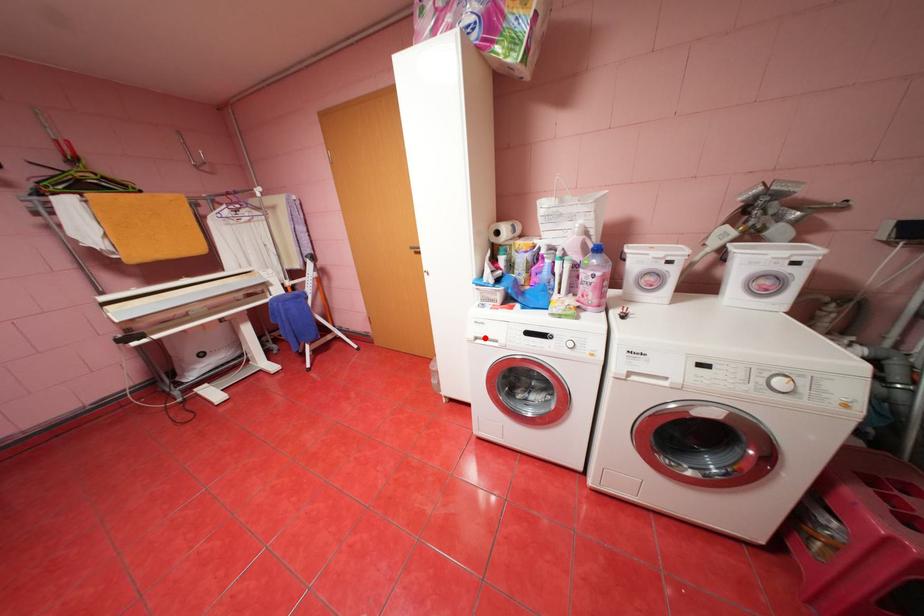
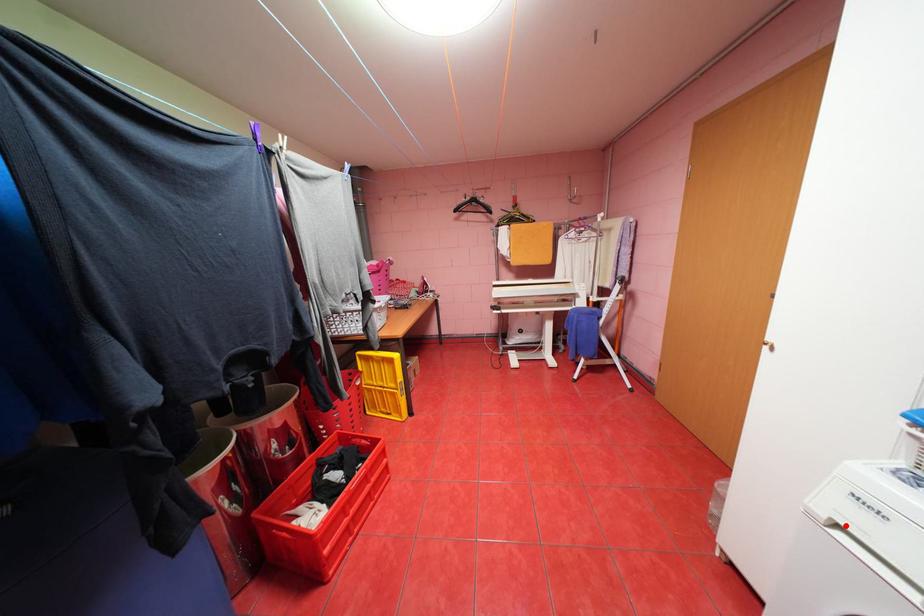
I am providing you with two images of the same scene from different viewpoints. A red point is marked on the first image and another point is marked on the second image. Do the highlighted points in image1 and image2 indicate the same real-world spot?

Yes